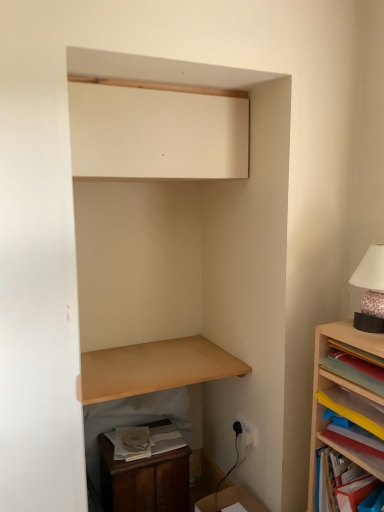
Question: Considering the relative positions of wooden dresser at lower left and light brown wood shelf at lower center, which ranks as the third shelf in right-to-left order, in the image provided, is wooden dresser at lower left behind light brown wood shelf at lower center, which ranks as the third shelf in right-to-left order,?

Choices:
 (A) yes
 (B) no

Answer: (A)

Question: From the image's perspective, is wooden dresser at lower left over light brown wood shelf at lower center, which ranks as the third shelf in right-to-left order?

Choices:
 (A) yes
 (B) no

Answer: (B)

Question: Is wooden dresser at lower left facing towards light brown wood shelf at lower center, which ranks as the third shelf in right-to-left order?

Choices:
 (A) no
 (B) yes

Answer: (A)

Question: From a real-world perspective, is wooden dresser at lower left beneath light brown wood shelf at lower center, acting as the first shelf starting from the left?

Choices:
 (A) yes
 (B) no

Answer: (A)

Question: Does wooden dresser at lower left have a lesser width compared to light brown wood shelf at lower center, acting as the first shelf starting from the left?

Choices:
 (A) no
 (B) yes

Answer: (B)

Question: Is matte yellow book at right, the second book in the bottom-to-top sequence, wider or thinner than wooden dresser at lower left?

Choices:
 (A) wide
 (B) thin

Answer: (B)

Question: From a real-world perspective, relative to wooden dresser at lower left, is matte yellow book at right, which is the 1th book in top-to-bottom order, vertically above or below?

Choices:
 (A) above
 (B) below

Answer: (A)

Question: In terms of height, does matte yellow book at right, the second book in the bottom-to-top sequence, look taller or shorter compared to wooden dresser at lower left?

Choices:
 (A) short
 (B) tall

Answer: (A)

Question: From the image's perspective, is matte yellow book at right, which is the 1th book in top-to-bottom order, positioned above or below wooden dresser at lower left?

Choices:
 (A) below
 (B) above

Answer: (B)

Question: Relative to white plastic electric outlet at lower right, is matte white cabinet at upper center in front or behind?

Choices:
 (A) front
 (B) behind

Answer: (A)

Question: Which is correct: matte white cabinet at upper center is inside white plastic electric outlet at lower right, or outside of it?

Choices:
 (A) inside
 (B) outside

Answer: (B)

Question: From the image's perspective, relative to white plastic electric outlet at lower right, is matte white cabinet at upper center above or below?

Choices:
 (A) above
 (B) below

Answer: (A)

Question: Looking at the image, does matte white cabinet at upper center seem bigger or smaller compared to white plastic electric outlet at lower right?

Choices:
 (A) small
 (B) big

Answer: (B)

Question: Is point (236, 487) positioned closer to the camera than point (182, 507)?

Choices:
 (A) farther
 (B) closer

Answer: (B)

Question: From the image's perspective, is cardboard box at lower right positioned above or below wooden dresser at lower left?

Choices:
 (A) below
 (B) above

Answer: (A)